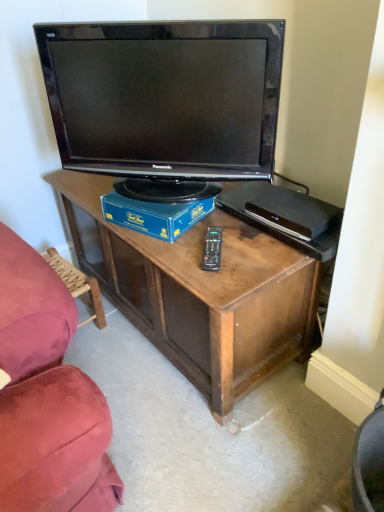
Question: From the image's perspective, is wooden swivel chair at lower left above matte black television at center?

Choices:
 (A) no
 (B) yes

Answer: (A)

Question: Is wooden swivel chair at lower left taller than matte black television at center?

Choices:
 (A) yes
 (B) no

Answer: (B)

Question: From the image's perspective, is wooden swivel chair at lower left located beneath matte black television at center?

Choices:
 (A) yes
 (B) no

Answer: (A)

Question: Is wooden swivel chair at lower left located outside matte black television at center?

Choices:
 (A) yes
 (B) no

Answer: (A)

Question: Is wooden swivel chair at lower left at the right side of matte black television at center?

Choices:
 (A) no
 (B) yes

Answer: (A)

Question: Is wooden swivel chair at lower left facing away from matte black television at center?

Choices:
 (A) no
 (B) yes

Answer: (A)

Question: From a real-world perspective, is matte black television at center positioned under blue cardboard box at center based on gravity?

Choices:
 (A) no
 (B) yes

Answer: (A)

Question: Is matte black television at center further to camera compared to blue cardboard box at center?

Choices:
 (A) yes
 (B) no

Answer: (B)

Question: Is matte black television at center thinner than blue cardboard box at center?

Choices:
 (A) no
 (B) yes

Answer: (B)

Question: From a real-world perspective, is matte black television at center on top of blue cardboard box at center?

Choices:
 (A) yes
 (B) no

Answer: (A)

Question: Is matte black television at center looking in the opposite direction of blue cardboard box at center?

Choices:
 (A) yes
 (B) no

Answer: (B)

Question: Considering the relative positions of matte black television at center and blue cardboard box at center in the image provided, is matte black television at center to the right of blue cardboard box at center from the viewer's perspective?

Choices:
 (A) yes
 (B) no

Answer: (B)

Question: Would you say wooden swivel chair at lower left is part of matte black television at center's contents?

Choices:
 (A) yes
 (B) no

Answer: (B)